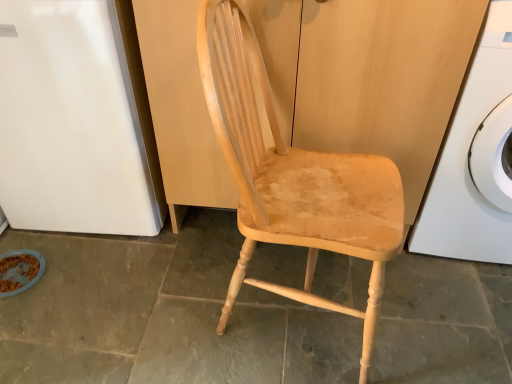
The width and height of the screenshot is (512, 384). In order to click on free location to the right of brown crumbly food at lower left in this screenshot , I will do `click(65, 281)`.